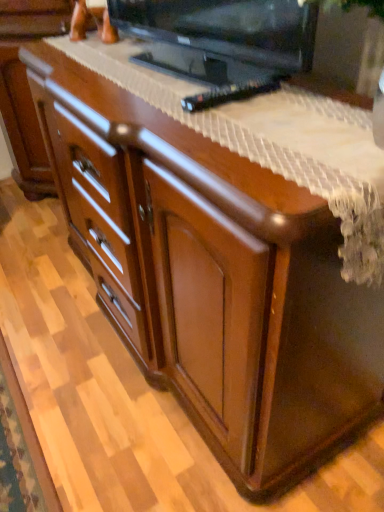
Find the location of a particular element. free space in front of black plastic remote at center is located at coordinates (238, 123).